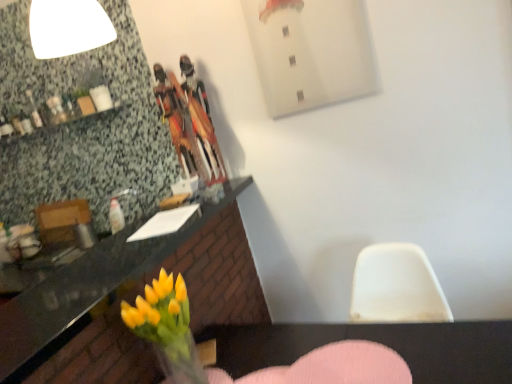
Question: Can you confirm if pink fabric armchair at lower center is taller than granite countertop at lower left?

Choices:
 (A) no
 (B) yes

Answer: (A)

Question: From a real-world perspective, is pink fabric armchair at lower center located higher than granite countertop at lower left?

Choices:
 (A) yes
 (B) no

Answer: (B)

Question: Would you say pink fabric armchair at lower center is a long distance from granite countertop at lower left?

Choices:
 (A) yes
 (B) no

Answer: (B)

Question: Is granite countertop at lower left a part of pink fabric armchair at lower center?

Choices:
 (A) yes
 (B) no

Answer: (B)

Question: From the image's perspective, is pink fabric armchair at lower center over granite countertop at lower left?

Choices:
 (A) yes
 (B) no

Answer: (B)

Question: Would you say granite countertop at lower left is to the left or to the right of pink fabric armchair at lower center in the picture?

Choices:
 (A) right
 (B) left

Answer: (B)

Question: In terms of width, does granite countertop at lower left look wider or thinner when compared to pink fabric armchair at lower center?

Choices:
 (A) wide
 (B) thin

Answer: (A)

Question: Is point (70, 382) closer or farther from the camera than point (360, 370)?

Choices:
 (A) closer
 (B) farther

Answer: (A)

Question: Relative to pink fabric armchair at lower center, is granite countertop at lower left in front or behind?

Choices:
 (A) behind
 (B) front

Answer: (B)

Question: Does point 179,352 appear closer or farther from the camera than point 300,369?

Choices:
 (A) closer
 (B) farther

Answer: (A)

Question: Which is correct: yellow glass vase at lower left is inside pink fabric armchair at lower center, or outside of it?

Choices:
 (A) inside
 (B) outside

Answer: (B)

Question: From a real-world perspective, is yellow glass vase at lower left positioned above or below pink fabric armchair at lower center?

Choices:
 (A) above
 (B) below

Answer: (A)

Question: In the image, is yellow glass vase at lower left positioned in front of or behind pink fabric armchair at lower center?

Choices:
 (A) behind
 (B) front

Answer: (A)

Question: Looking at the image, does pink fabric armchair at lower center seem bigger or smaller compared to yellow glass vase at lower left?

Choices:
 (A) small
 (B) big

Answer: (A)

Question: In terms of width, does pink fabric armchair at lower center look wider or thinner when compared to yellow glass vase at lower left?

Choices:
 (A) wide
 (B) thin

Answer: (A)